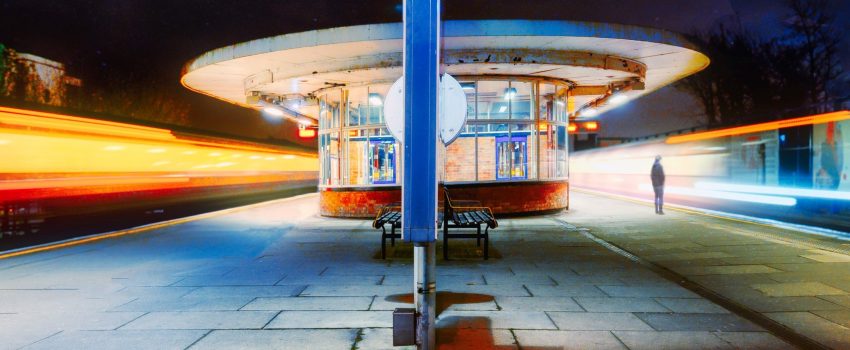
Where is `benches`? The height and width of the screenshot is (350, 850). benches is located at coordinates (485, 220), (393, 220).